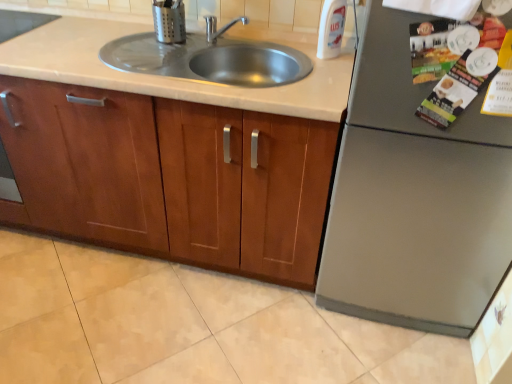
Where is `blank area to the left of white plastic bottle at upper right`? The height and width of the screenshot is (384, 512). blank area to the left of white plastic bottle at upper right is located at coordinates (293, 52).